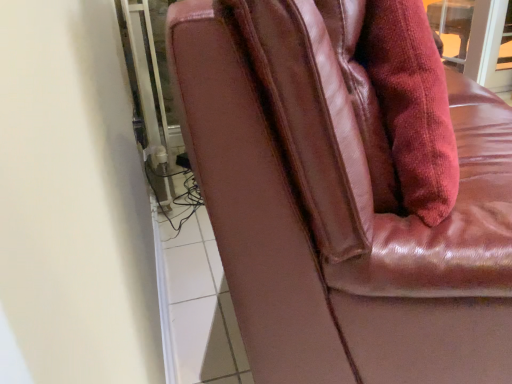
This screenshot has height=384, width=512. Describe the element at coordinates (339, 202) in the screenshot. I see `shiny brown leather couch at right` at that location.

Where is `shiny brown leather couch at right`? The width and height of the screenshot is (512, 384). shiny brown leather couch at right is located at coordinates (339, 202).

Image resolution: width=512 pixels, height=384 pixels. I want to click on shiny brown leather couch at right, so click(339, 202).